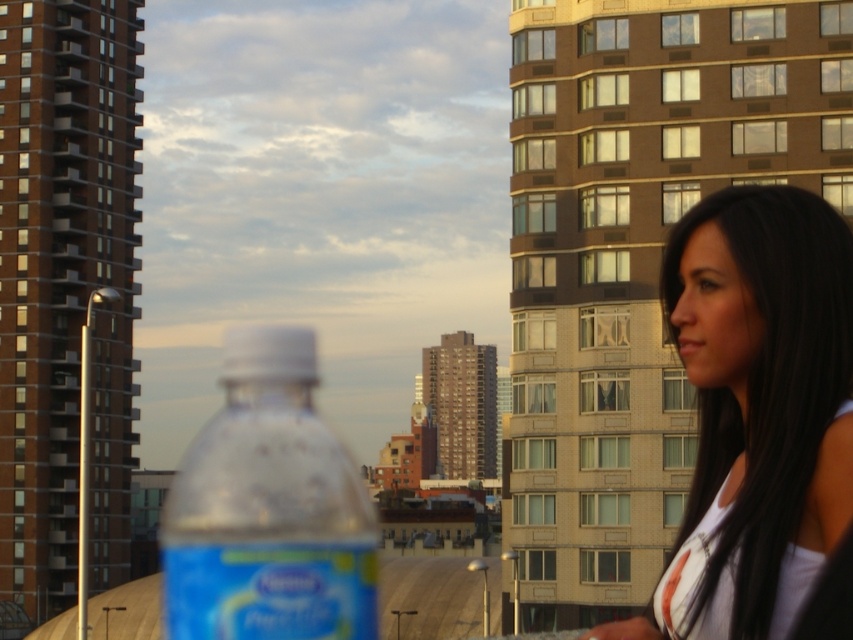
Question: Which point is farther to the camera?

Choices:
 (A) (364, 547)
 (B) (779, 628)

Answer: (A)

Question: Is smooth white tank top at right thinner than translucent plastic bottle at center?

Choices:
 (A) no
 (B) yes

Answer: (B)

Question: Which point is closer to the camera taking this photo?

Choices:
 (A) (699, 372)
 (B) (231, 396)

Answer: (A)

Question: Is smooth white tank top at right thinner than translucent plastic bottle at center?

Choices:
 (A) yes
 (B) no

Answer: (A)

Question: Which point is farther to the camera?

Choices:
 (A) translucent plastic bottle at center
 (B) smooth white tank top at right

Answer: (A)

Question: Is smooth white tank top at right to the right of translucent plastic bottle at center from the viewer's perspective?

Choices:
 (A) yes
 (B) no

Answer: (A)